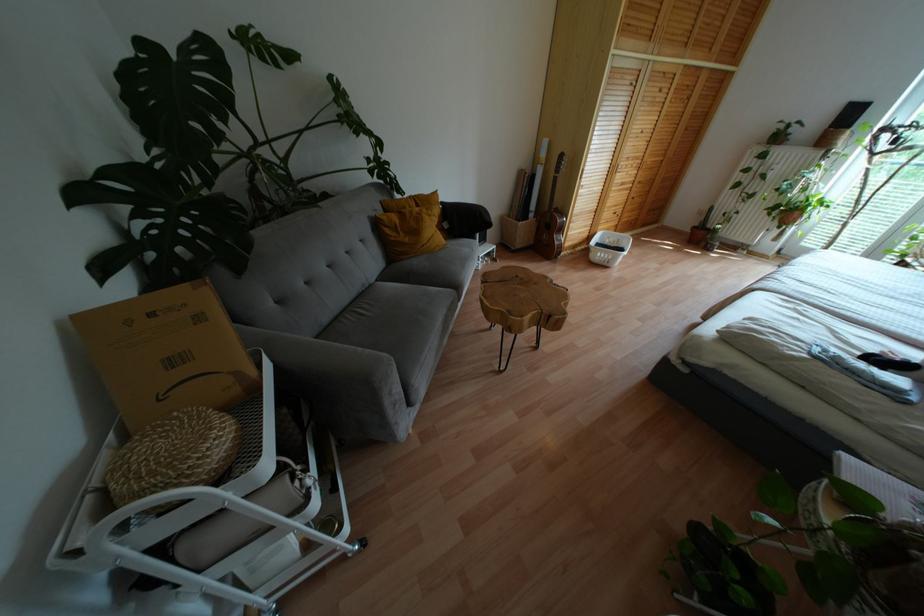
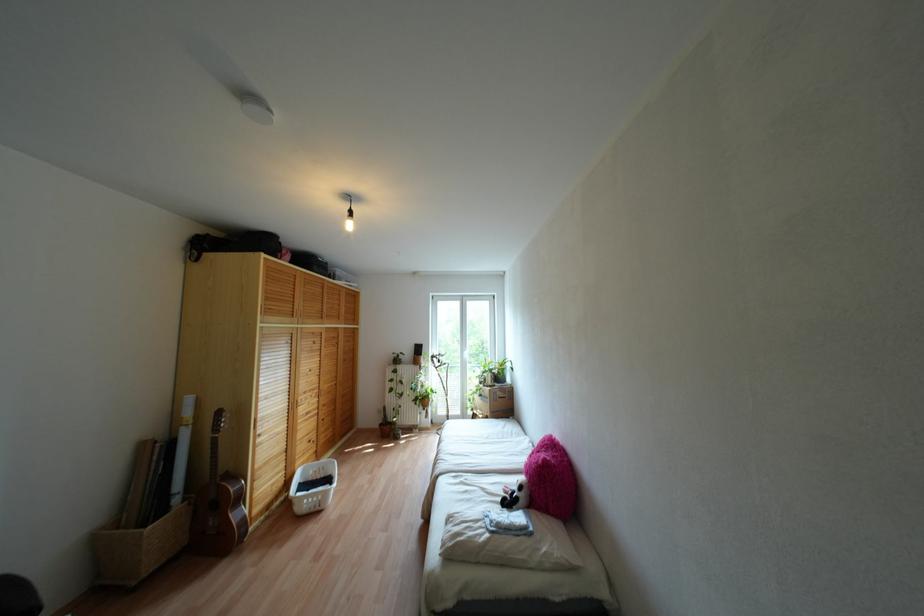
Find the pixel in the second image that matches [718,84] in the first image.

(351, 334)